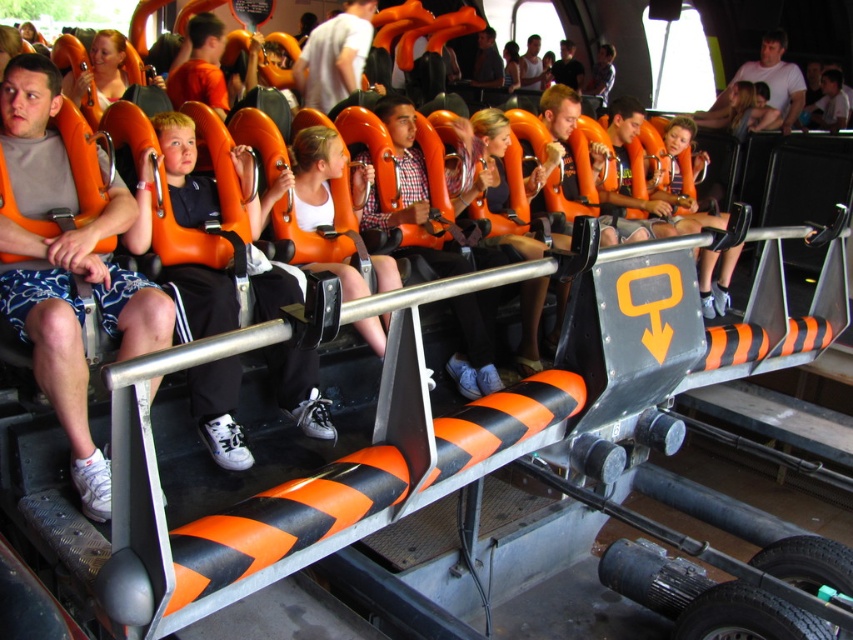
Between matte white shirt at upper center and black matte shirt at center, which one is positioned higher?

Positioned higher is black matte shirt at center.

Can you confirm if matte white shirt at upper center is smaller than black matte shirt at center?

No.

Where is `matte white shirt at upper center`? This screenshot has height=640, width=853. matte white shirt at upper center is located at coordinates (769, 81).

The width and height of the screenshot is (853, 640). I want to click on matte white shirt at upper center, so click(x=769, y=81).

Is matte gray shorts at left positioned before black matte shirt at center?

Yes, matte gray shorts at left is in front of black matte shirt at center.

Is matte gray shorts at left positioned behind black matte shirt at center?

No, matte gray shorts at left is in front of black matte shirt at center.

Does point (148, 333) come behind point (567, 49)?

No, (148, 333) is closer to viewer.

Where is `matte gray shorts at left`? matte gray shorts at left is located at coordinates pyautogui.click(x=79, y=323).

Does matte black shirt at center have a lesser width compared to black matte shirt at center?

No.

Does matte black shirt at center have a greater height compared to black matte shirt at center?

In fact, matte black shirt at center may be shorter than black matte shirt at center.

Is point (491, 81) in front of point (576, 67)?

Yes, it is in front of point (576, 67).

The image size is (853, 640). What are the coordinates of `matte black shirt at center` in the screenshot? It's located at (486, 61).